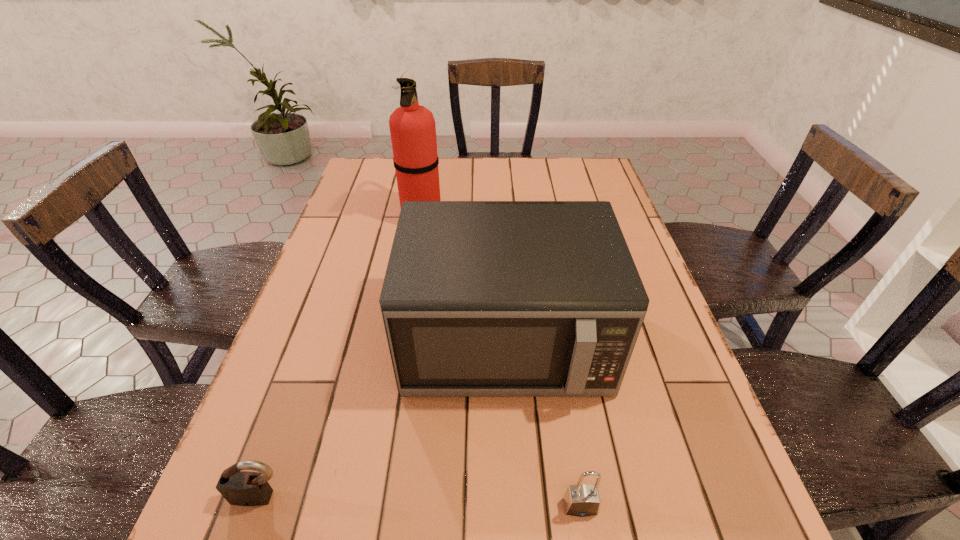
The image size is (960, 540). In order to click on free space at the far edge of the desktop in this screenshot , I will do `click(459, 166)`.

You are a GUI agent. You are given a task and a screenshot of the screen. Output one action in this format:
    pyautogui.click(x=<x>, y=<y>)
    Task: Click on the free region at the left edge of the desktop
    
    Given the screenshot: What is the action you would take?
    pyautogui.click(x=372, y=253)

Find the location of a particular element. The width and height of the screenshot is (960, 540). vacant space at the right edge of the desktop is located at coordinates (650, 355).

Where is `vacant space at the far left corner of the desktop`? This screenshot has height=540, width=960. vacant space at the far left corner of the desktop is located at coordinates (380, 185).

Locate an element on the screen. This screenshot has width=960, height=540. free location at the far right corner of the desktop is located at coordinates 603,178.

At what (x,y) coordinates should I click in order to perform the action: click on unoccupied position between the right padlock and the microwave oven. Please return your answer as a coordinate pair (x, y). The image size is (960, 540). Looking at the image, I should click on (542, 422).

You are a GUI agent. You are given a task and a screenshot of the screen. Output one action in this format:
    pyautogui.click(x=<x>, y=<y>)
    Task: Click on the vacant area between the leftmost object and the right padlock
    
    Given the screenshot: What is the action you would take?
    pyautogui.click(x=420, y=502)

The height and width of the screenshot is (540, 960). In order to click on unoccupied area between the microwave oven and the leftmost object in this screenshot , I will do `click(383, 418)`.

At what (x,y) coordinates should I click in order to perform the action: click on object that can be found as the second closest to the right padlock. Please return your answer as a coordinate pair (x, y). Looking at the image, I should click on (242, 488).

Select which object appears as the closest to the left padlock. Please provide its 2D coordinates. Your answer should be formatted as a tuple, i.e. [(x, y)], where the tuple contains the x and y coordinates of a point satisfying the conditions above.

[(480, 298)]